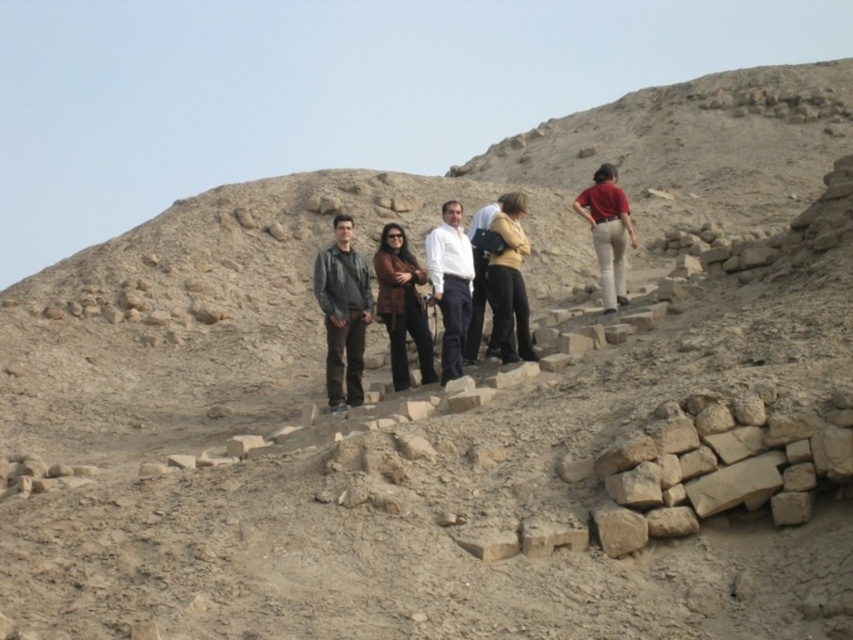
Does dark gray leather jacket at center appear on the left side of matte beige jacket at center?

Yes, dark gray leather jacket at center is to the left of matte beige jacket at center.

Locate an element on the screen. This screenshot has width=853, height=640. dark gray leather jacket at center is located at coordinates (343, 314).

Can you confirm if matte beige jacket at center is taller than matte red shirt at upper right?

Incorrect, matte beige jacket at center's height is not larger of matte red shirt at upper right's.

Does matte beige jacket at center have a smaller size compared to matte red shirt at upper right?

Indeed, matte beige jacket at center has a smaller size compared to matte red shirt at upper right.

The height and width of the screenshot is (640, 853). Find the location of `matte beige jacket at center`. matte beige jacket at center is located at coordinates (509, 282).

Between point (460, 284) and point (497, 291), which one is positioned in front?

Positioned in front is point (497, 291).

This screenshot has width=853, height=640. Describe the element at coordinates (450, 284) in the screenshot. I see `white shirt at center` at that location.

Does point (444, 250) come farther from viewer compared to point (527, 353)?

That is True.

This screenshot has height=640, width=853. What are the coordinates of `white shirt at center` in the screenshot? It's located at (450, 284).